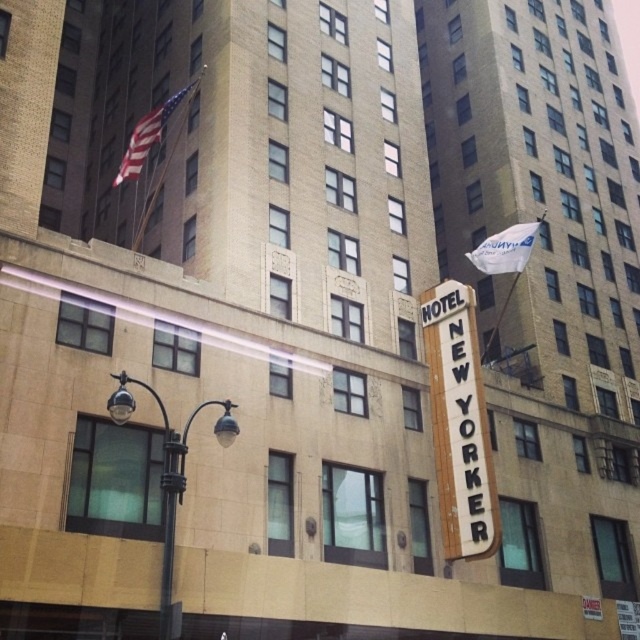
You are standing in front of the Hotel New Yorker building. You notice two points marked on the building facade. The first point is located at coordinate point(476, 348) and the second at point(163, 451). From your vantage point, which point appears closer to you?

Point(163, 451) appears closer to you because it is in front of point(476, 348).

You are standing in front of the Hotel New Yorker building. There are two points marked on the building facade. The first point is at coordinate point(168,540) and the second point is at coordinate point(513,252). Which point is closer to you?

Point(168,540) is in front of point(513,252), so the first point is closer to you.